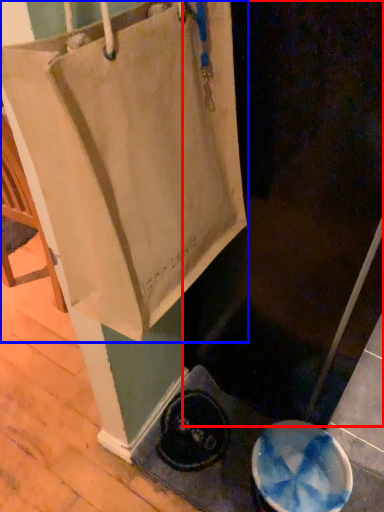
Question: Which of the following is the closest to the observer, screen door (highlighted by a red box) or tote bag (highlighted by a blue box)?

Choices:
 (A) screen door
 (B) tote bag

Answer: (B)